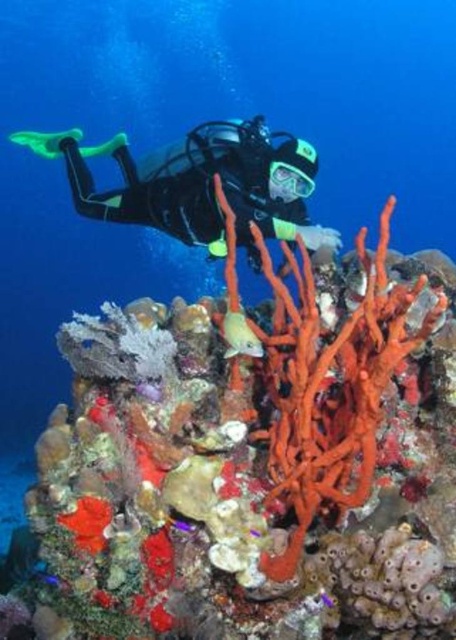
Question: Can you confirm if orange sponge at center is positioned to the left of purple glossy fish at center?

Choices:
 (A) no
 (B) yes

Answer: (B)

Question: Can you confirm if blue glossy fish at lower left is positioned to the right of purple glossy fish at center?

Choices:
 (A) yes
 (B) no

Answer: (B)

Question: Considering the real-world distances, which object is closest to the purple glossy fish at center?

Choices:
 (A) blue glossy fish at lower left
 (B) smooth yellow fish at center
 (C) orange sponge at center

Answer: (A)

Question: Can you confirm if blue glossy fish at lower left is thinner than purple glossy fish at center?

Choices:
 (A) yes
 (B) no

Answer: (B)

Question: Among these objects, which one is farthest from the camera?

Choices:
 (A) purple glossy fish at center
 (B) orange sponge at center
 (C) blue glossy fish at lower left

Answer: (A)

Question: Which point is closer to the camera?

Choices:
 (A) (299, 336)
 (B) (278, 218)
 (C) (176, 518)

Answer: (A)